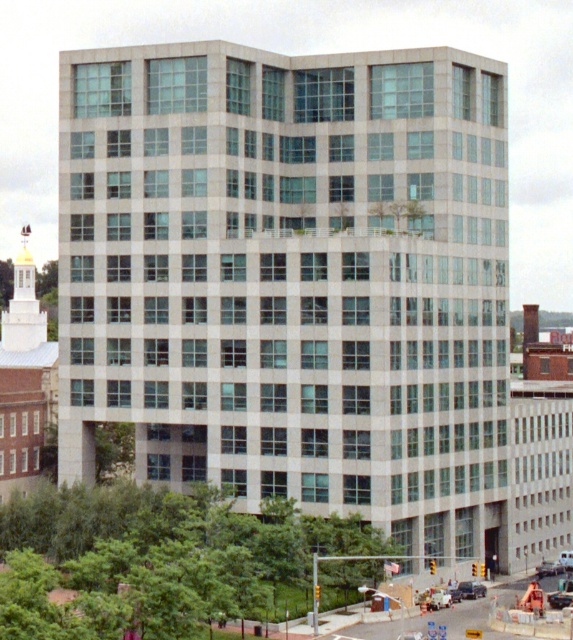
You are a delivery person trying to park your white matte car at center between two other vehicles. The metallic silver sedan at lower right is already parked there. Can you fit your car in the available space?

The metallic silver sedan at lower right is bigger than white matte car at center, so there might not be enough space for the white matte car at center to fit between the vehicles if the sedan is already occupying the spot. You should look for another parking spot.

You are standing in front of the modern multi story building and want to determine the relative positions of two points marked on the facade. The points are labeled as point (536, 570) and point (562, 552). Which point is closer to you?

Point (536, 570) is closer to the viewer than point (562, 552).

You are a delivery driver who needs to park your vehicle in a space that can accommodate the widest car between the metallic silver sedan at lower right and the white matte car at center. Which car should you choose to park?

The metallic silver sedan at lower right might be wider than white matte car at center, so you should choose the metallic silver sedan at lower right to ensure the parking space can accommodate its width.